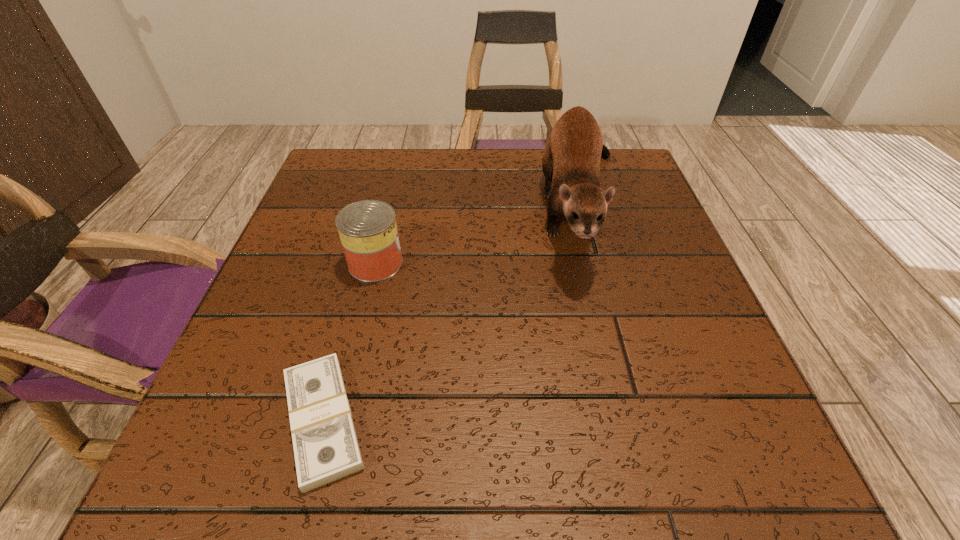
The height and width of the screenshot is (540, 960). Identify the location of the tallest object. (571, 161).

The width and height of the screenshot is (960, 540). Identify the location of the rightmost object. (571, 161).

Find the location of a particular element. The width and height of the screenshot is (960, 540). the second shortest object is located at coordinates (367, 229).

The height and width of the screenshot is (540, 960). In order to click on the shortest object in this screenshot , I will do `click(326, 449)`.

Locate an element on the screen. This screenshot has height=540, width=960. the nearest object is located at coordinates (326, 449).

Where is `free spot located 0.330m at the face of the rightmost object`? free spot located 0.330m at the face of the rightmost object is located at coordinates (660, 491).

Identify the location of vacant space located on the front of the can. This screenshot has width=960, height=540. (325, 468).

Where is `free location located on the back of the shortest object`? Image resolution: width=960 pixels, height=540 pixels. free location located on the back of the shortest object is located at coordinates (362, 274).

You are a GUI agent. You are given a task and a screenshot of the screen. Output one action in this format:
    pyautogui.click(x=<x>, y=<y>)
    Task: Click on the object present at the far edge
    
    Given the screenshot: What is the action you would take?
    pyautogui.click(x=571, y=161)

At what (x,y) coordinates should I click in order to perform the action: click on object present at the near edge. Please return your answer as a coordinate pair (x, y). This screenshot has width=960, height=540. Looking at the image, I should click on (326, 449).